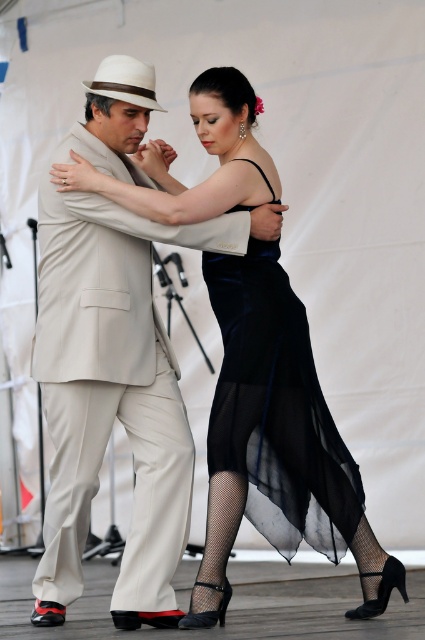
Question: Does beige fabric suit at center appear on the left side of velvet black dress at center?

Choices:
 (A) yes
 (B) no

Answer: (A)

Question: Which point is farther from the camera taking this photo?

Choices:
 (A) (127, 624)
 (B) (248, 410)

Answer: (B)

Question: In this image, where is beige fabric suit at center located relative to velvet black dress at center?

Choices:
 (A) below
 (B) above

Answer: (B)

Question: Does beige fabric suit at center appear over velvet black dress at center?

Choices:
 (A) no
 (B) yes

Answer: (B)

Question: Which of the following is the closest to the observer?

Choices:
 (A) (283, 472)
 (B) (153, 492)

Answer: (A)

Question: Which point is closer to the camera taking this photo?

Choices:
 (A) (271, 493)
 (B) (150, 301)

Answer: (A)